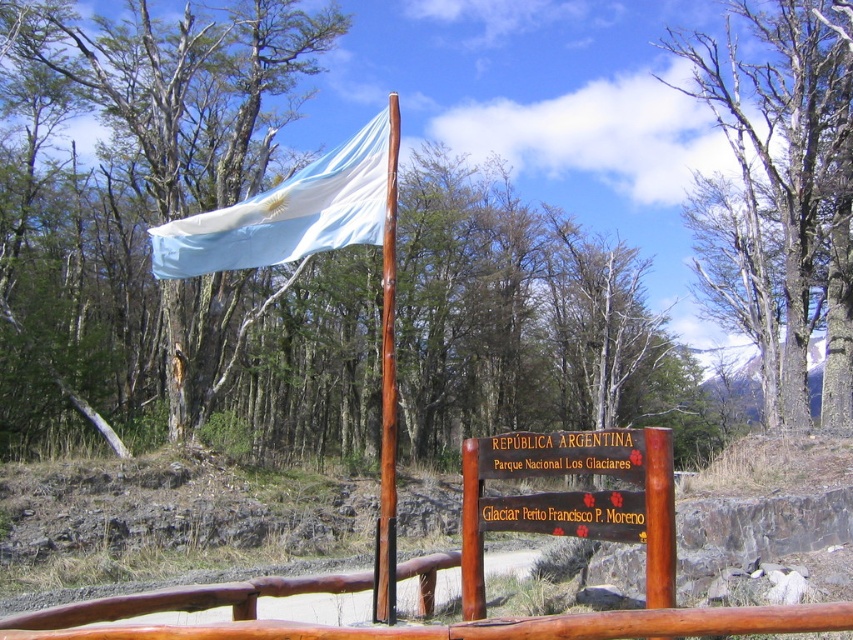
Measure the distance between smooth bark tree at upper left and camera.

smooth bark tree at upper left and camera are 70.28 feet apart from each other.

The width and height of the screenshot is (853, 640). I want to click on smooth bark tree at upper left, so 132,205.

Between point (701, 180) and point (614, 504), which one is positioned in front?

Point (614, 504) is more forward.

Identify the location of bare wood tree at upper center. (781, 195).

Can you confirm if white fabric flag at upper center is positioned to the left of brown wood pole at center?

Indeed, white fabric flag at upper center is positioned on the left side of brown wood pole at center.

Is point (291, 234) more distant than point (383, 492)?

That is True.

The height and width of the screenshot is (640, 853). I want to click on white fabric flag at upper center, so click(x=288, y=212).

Find the location of a particular element. white fabric flag at upper center is located at coordinates (288, 212).